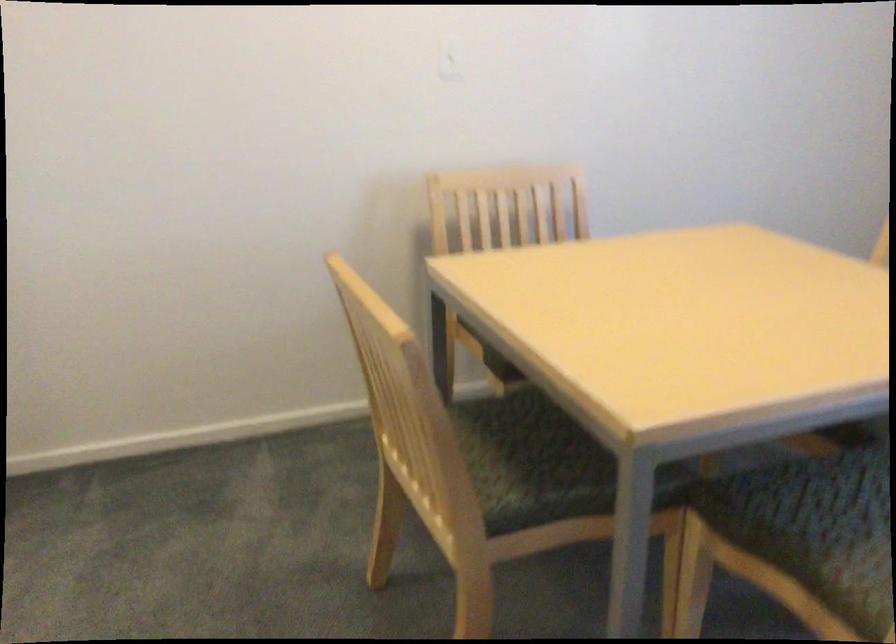
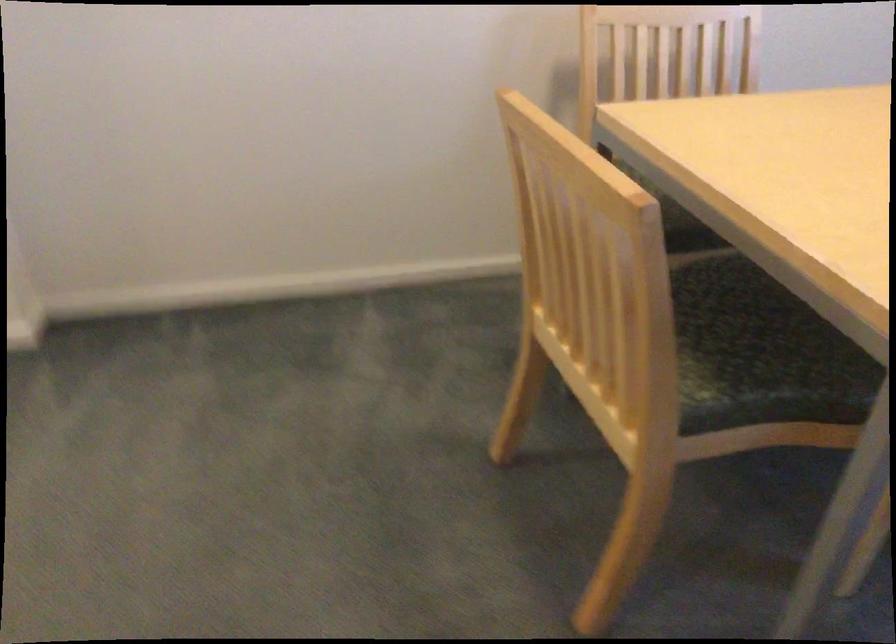
Question: The images are taken continuously from a first-person perspective. In which direction is your viewpoint rotating?

Choices:
 (A) Left
 (B) Right
 (C) Up
 (D) Down

Answer: (D)